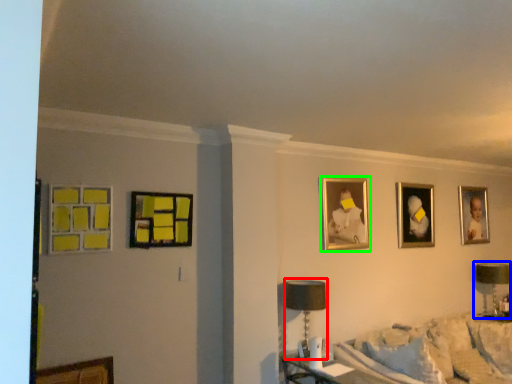
Question: Which is nearer to the table lamp (highlighted by a red box)? table lamp (highlighted by a blue box) or picture frame (highlighted by a green box).

Choices:
 (A) table lamp
 (B) picture frame

Answer: (B)